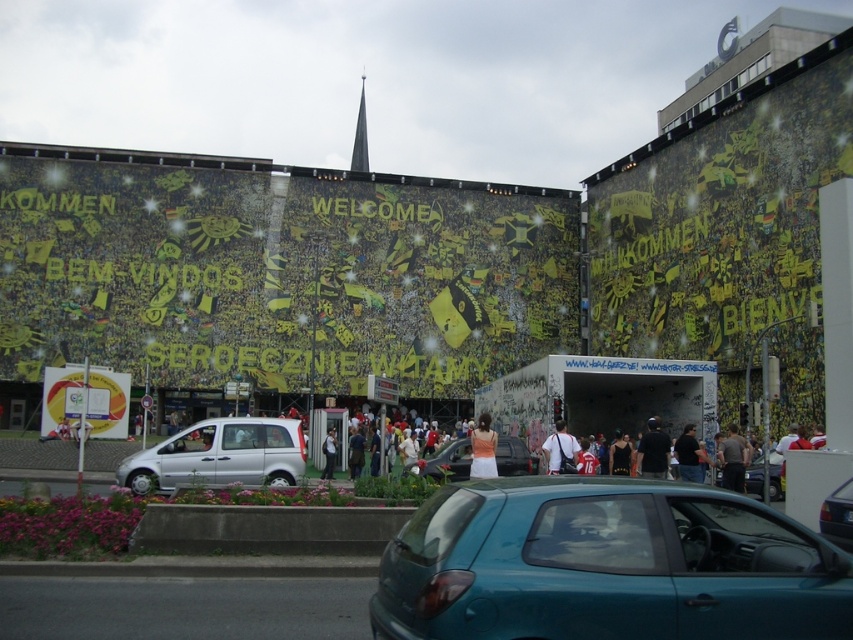
Is teal glossy hatchback at center smaller than teal glossy car at lower center?

Correct, teal glossy hatchback at center occupies less space than teal glossy car at lower center.

Is point (509, 580) more distant than point (848, 548)?

No, (509, 580) is in front of (848, 548).

Identify the location of teal glossy hatchback at center. The height and width of the screenshot is (640, 853). (606, 564).

Does silver metallic van at center have a larger size compared to metallic silver car at center?

Yes, silver metallic van at center is bigger than metallic silver car at center.

Is the position of silver metallic van at center less distant than that of metallic silver car at center?

Yes, it is.

Image resolution: width=853 pixels, height=640 pixels. Describe the element at coordinates (219, 456) in the screenshot. I see `silver metallic van at center` at that location.

Locate an element on the screen. silver metallic van at center is located at coordinates (219, 456).

Who is more distant from viewer, [662,470] or [728,432]?

The point [728,432] is behind.

From the picture: Is black fabric person at center to the left of brown leather jacket at center from the viewer's perspective?

Indeed, black fabric person at center is positioned on the left side of brown leather jacket at center.

Between point (666, 444) and point (718, 445), which one is positioned behind?

The point (718, 445) is behind.

The image size is (853, 640). What are the coordinates of `black fabric person at center` in the screenshot? It's located at pyautogui.click(x=653, y=451).